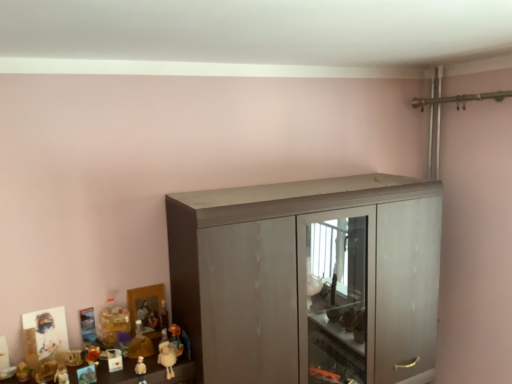
This screenshot has height=384, width=512. In order to click on white plush sheep at lower left, positioned as the first toy in right-to-left order in this screenshot , I will do `click(168, 357)`.

Measure the distance between matte gray cupboard at center and camera.

A distance of 1.33 meters exists between matte gray cupboard at center and camera.

What is the approximate width of matte plastic figurine at lower left, which ranks as the second toy in right-to-left order?

2.78 inches.

Where is `matte plastic toy at lower left, positioned as the eighth toy in right-to-left order`? matte plastic toy at lower left, positioned as the eighth toy in right-to-left order is located at coordinates (48, 330).

The width and height of the screenshot is (512, 384). What do you see at coordinates (92, 355) in the screenshot?
I see `shiny orange toy at lower left, the sixth toy viewed from the right` at bounding box center [92, 355].

You are a GUI agent. You are given a task and a screenshot of the screen. Output one action in this format:
    pyautogui.click(x=<x>, y=<y>)
    Task: Click on the matte plastic toy at lower left, which ranks as the 5th toy in right-to-left order
    
    Given the screenshot: What is the action you would take?
    pyautogui.click(x=87, y=375)

Which is closer, (114, 316) or (88, 380)?

Point (114, 316) is positioned farther from the camera compared to point (88, 380).

Considering the sizes of objects translucent plastic toy at lower left, arranged as the fourth toy when viewed from the right, and matte plastic toy at lower left, which ranks as the 5th toy in right-to-left order, in the image provided, who is smaller, translucent plastic toy at lower left, arranged as the fourth toy when viewed from the right, or matte plastic toy at lower left, which ranks as the 5th toy in right-to-left order,?

matte plastic toy at lower left, which ranks as the 5th toy in right-to-left order, is smaller.

From a real-world perspective, is translucent plastic toy at lower left, acting as the fifth toy starting from the left, below matte plastic toy at lower left, which ranks as the 5th toy in right-to-left order?

No, from a real-world perspective, translucent plastic toy at lower left, acting as the fifth toy starting from the left, is not beneath matte plastic toy at lower left, which ranks as the 5th toy in right-to-left order.

Between translucent plastic toy at lower left, acting as the fifth toy starting from the left, and matte plastic toy at lower left, acting as the 4th toy starting from the left, which one has smaller width?

With smaller width is matte plastic toy at lower left, acting as the 4th toy starting from the left.

Is white plush sheep at lower left, positioned as the first toy in right-to-left order, to the left of matte plastic toy at lower left, positioned as the eighth toy in right-to-left order, from the viewer's perspective?

No, white plush sheep at lower left, positioned as the first toy in right-to-left order, is not to the left of matte plastic toy at lower left, positioned as the eighth toy in right-to-left order.

Does white plush sheep at lower left, which ranks as the 8th toy in left-to-right order, have a larger size compared to matte plastic toy at lower left, positioned as the eighth toy in right-to-left order?

Actually, white plush sheep at lower left, which ranks as the 8th toy in left-to-right order, might be smaller than matte plastic toy at lower left, positioned as the eighth toy in right-to-left order.

Between white plush sheep at lower left, which ranks as the 8th toy in left-to-right order, and matte plastic toy at lower left, which is the 1th toy from left to right, which one has more height?

matte plastic toy at lower left, which is the 1th toy from left to right, is taller.

From a real-world perspective, is shiny orange toy at lower left, which appears as the 3th toy when viewed from the left, above or below matte plastic figurine at lower left, which ranks as the second toy in right-to-left order?

From a real-world perspective, shiny orange toy at lower left, which appears as the 3th toy when viewed from the left, is physically above matte plastic figurine at lower left, which ranks as the second toy in right-to-left order.

What's the angular difference between shiny orange toy at lower left, the sixth toy viewed from the right, and matte plastic figurine at lower left, the seventh toy viewed from the left,'s facing directions?

The facing directions of shiny orange toy at lower left, the sixth toy viewed from the right, and matte plastic figurine at lower left, the seventh toy viewed from the left, are 2.55 degrees apart.

Is shiny orange toy at lower left, which appears as the 3th toy when viewed from the left, bigger or smaller than matte plastic figurine at lower left, the seventh toy viewed from the left?

shiny orange toy at lower left, which appears as the 3th toy when viewed from the left, is smaller than matte plastic figurine at lower left, the seventh toy viewed from the left.

Considering the relative sizes of shiny orange toy at lower left, which appears as the 3th toy when viewed from the left, and matte plastic figurine at lower left, which ranks as the second toy in right-to-left order, in the image provided, is shiny orange toy at lower left, which appears as the 3th toy when viewed from the left, shorter than matte plastic figurine at lower left, which ranks as the second toy in right-to-left order,?

Correct, shiny orange toy at lower left, which appears as the 3th toy when viewed from the left, is not as tall as matte plastic figurine at lower left, which ranks as the second toy in right-to-left order.

Which is closer, (x=160, y=347) or (x=312, y=181)?

Point (x=160, y=347).

Does white plush sheep at lower left, which ranks as the 8th toy in left-to-right order, have a lesser width compared to matte gray cupboard at center?

Indeed, white plush sheep at lower left, which ranks as the 8th toy in left-to-right order, has a lesser width compared to matte gray cupboard at center.

Is white plush sheep at lower left, which ranks as the 8th toy in left-to-right order, bigger or smaller than matte gray cupboard at center?

Clearly, white plush sheep at lower left, which ranks as the 8th toy in left-to-right order, is smaller in size than matte gray cupboard at center.

Is white plush sheep at lower left, which ranks as the 8th toy in left-to-right order, surrounding matte gray cupboard at center?

No.

Which object is further away from the camera, matte brown figurine at lower left, the second toy when ordered from left to right, or matte plastic figurine at lower left, which ranks as the second toy in right-to-left order?

matte plastic figurine at lower left, which ranks as the second toy in right-to-left order, is more distant.

Is matte brown figurine at lower left, the second toy when ordered from left to right, turned away from matte plastic figurine at lower left, which ranks as the second toy in right-to-left order?

That's not correct — matte brown figurine at lower left, the second toy when ordered from left to right, is not looking away from matte plastic figurine at lower left, which ranks as the second toy in right-to-left order.

From the image's perspective, is matte brown figurine at lower left, the second toy when ordered from left to right, on top of matte plastic figurine at lower left, the seventh toy viewed from the left?

Yes, from the image's perspective, matte brown figurine at lower left, the second toy when ordered from left to right, is over matte plastic figurine at lower left, the seventh toy viewed from the left.

Is matte plastic toy at lower left, which is the 1th toy from left to right, to the left of matte plastic toy at lower left, acting as the 4th toy starting from the left, from the viewer's perspective?

Yes.

Based on the photo, can you confirm if matte plastic toy at lower left, positioned as the eighth toy in right-to-left order, is shorter than matte plastic toy at lower left, which ranks as the 5th toy in right-to-left order?

No.

Consider the image. Is matte plastic toy at lower left, positioned as the eighth toy in right-to-left order, next to matte plastic toy at lower left, which ranks as the 5th toy in right-to-left order, and touching it?

No, matte plastic toy at lower left, positioned as the eighth toy in right-to-left order, is not next to matte plastic toy at lower left, which ranks as the 5th toy in right-to-left order.

Is matte plastic toy at lower left, which is the 1th toy from left to right, oriented away from matte plastic toy at lower left, which ranks as the 5th toy in right-to-left order?

No, matte plastic toy at lower left, which is the 1th toy from left to right, is not facing the opposite direction of matte plastic toy at lower left, which ranks as the 5th toy in right-to-left order.

Which toy is the 1st one when counting from the back of the white plush sheep at lower left, which ranks as the 8th toy in left-to-right order? Please provide its 2D coordinates.

[(92, 355)]

Can you confirm if white plush sheep at lower left, positioned as the first toy in right-to-left order, is positioned to the right of shiny orange toy at lower left, the sixth toy viewed from the right?

Yes.

Which object is wider, white plush sheep at lower left, which ranks as the 8th toy in left-to-right order, or shiny orange toy at lower left, which appears as the 3th toy when viewed from the left?

white plush sheep at lower left, which ranks as the 8th toy in left-to-right order.

Could shiny orange toy at lower left, which appears as the 3th toy when viewed from the left, be considered to be inside white plush sheep at lower left, positioned as the first toy in right-to-left order?

Actually, shiny orange toy at lower left, which appears as the 3th toy when viewed from the left, is outside white plush sheep at lower left, positioned as the first toy in right-to-left order.

The height and width of the screenshot is (384, 512). What are the coordinates of `the 6th toy above the matte plastic toy at lower left, acting as the 4th toy starting from the left (from the image's perspective)` in the screenshot? It's located at (113, 324).

Find the location of a particular element. The height and width of the screenshot is (384, 512). the 5th toy directly beneath the matte plastic toy at lower left, positioned as the eighth toy in right-to-left order (from a real-world perspective) is located at coordinates (168, 357).

Which object lies further to the anchor point shiny orange toy at lower left, which appears as the 3th toy when viewed from the left, matte brown figurine at lower left, the second toy when ordered from left to right, or white plush sheep at lower left, positioned as the first toy in right-to-left order?

white plush sheep at lower left, positioned as the first toy in right-to-left order, is positioned further to the anchor shiny orange toy at lower left, which appears as the 3th toy when viewed from the left.

Estimate the real-world distances between objects in this image. Which object is closer to translucent plastic toy at lower left, acting as the fifth toy starting from the left, matte plastic toy at lower left, which ranks as the 5th toy in right-to-left order, or matte gray cupboard at center?

matte plastic toy at lower left, which ranks as the 5th toy in right-to-left order, is closer to translucent plastic toy at lower left, acting as the fifth toy starting from the left.

Which object lies further to the anchor point matte gray cupboard at center, matte brown figurine at lower left, the second toy when ordered from left to right, or white plush sheep at lower left, which ranks as the 8th toy in left-to-right order?

matte brown figurine at lower left, the second toy when ordered from left to right, lies further to matte gray cupboard at center than the other object.

Which object lies further to the anchor point matte brown figurine at lower left, which is the seventh toy from right to left, shiny orange toy at lower left, which appears as the 3th toy when viewed from the left, or translucent plastic toy at lower left, arranged as the fourth toy when viewed from the right?

The object further to matte brown figurine at lower left, which is the seventh toy from right to left, is translucent plastic toy at lower left, arranged as the fourth toy when viewed from the right.

From the image, which object appears to be nearer to white plush sheep at lower left, which ranks as the 8th toy in left-to-right order, shiny orange toy at lower left, which appears as the 3th toy when viewed from the left, or matte gray cupboard at center?

Based on the image, shiny orange toy at lower left, which appears as the 3th toy when viewed from the left, appears to be nearer to white plush sheep at lower left, which ranks as the 8th toy in left-to-right order.

Based on their spatial positions, is matte plastic toy at lower left, which appears as the 6th toy when viewed from the left, or matte plastic toy at lower left, which is the 1th toy from left to right, further from matte gray cupboard at center?

matte plastic toy at lower left, which is the 1th toy from left to right, is positioned further to the anchor matte gray cupboard at center.

Considering their positions, is white plush sheep at lower left, positioned as the first toy in right-to-left order, positioned closer to matte plastic toy at lower left, positioned as the eighth toy in right-to-left order, than matte gray cupboard at center?

The object closer to matte plastic toy at lower left, positioned as the eighth toy in right-to-left order, is white plush sheep at lower left, positioned as the first toy in right-to-left order.

Looking at the image, which one is located further to matte plastic toy at lower left, which appears as the 6th toy when viewed from the left, shiny orange toy at lower left, which appears as the 3th toy when viewed from the left, or matte brown figurine at lower left, which is the seventh toy from right to left?

matte brown figurine at lower left, which is the seventh toy from right to left, lies further to matte plastic toy at lower left, which appears as the 6th toy when viewed from the left, than the other object.

What are the coordinates of `toy between matte plastic figurine at lower left, which ranks as the second toy in right-to-left order, and matte gray cupboard at center, in the horizontal direction` in the screenshot? It's located at (168, 357).

This screenshot has height=384, width=512. In order to click on toy between matte plastic toy at lower left, which is the 1th toy from left to right, and shiny orange toy at lower left, the sixth toy viewed from the right, in the horizontal direction in this screenshot , I will do `click(61, 374)`.

Find the location of a particular element. The width and height of the screenshot is (512, 384). toy located between matte plastic toy at lower left, which appears as the 6th toy when viewed from the left, and white plush sheep at lower left, positioned as the first toy in right-to-left order, in the left-right direction is located at coordinates (140, 370).